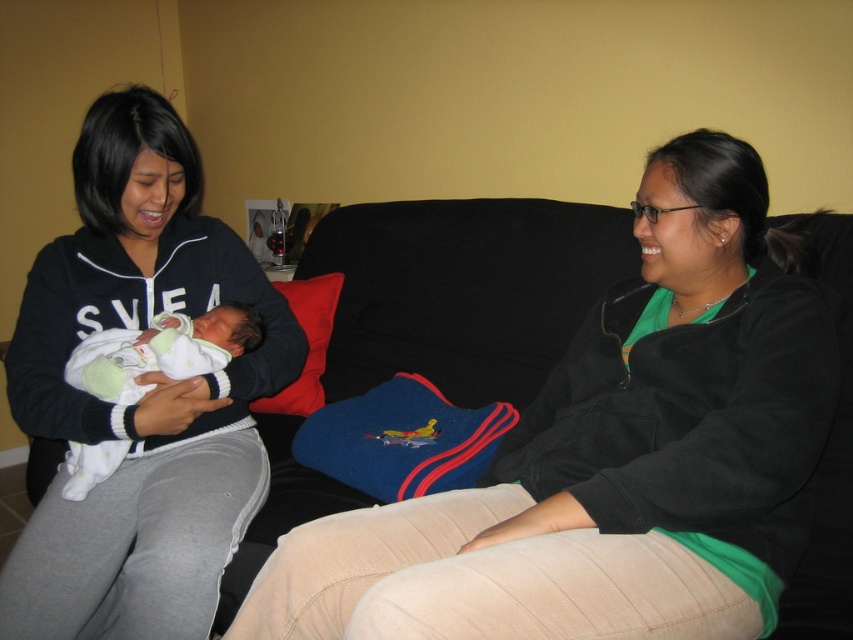
You are a tailor who needs to determine which garment requires more fabric for alterations. Based on the scene, which item has a greater width between the matte black jacket at center and the white knit sweater at left?

The matte black jacket at center has a greater width than the white knit sweater at left according to the description.

You are a tailor who needs to measure the distance between the matte black jacket at center and the white knit sweater at left for a custom fitting. Can you confirm if the space between them is sufficient to place a 24 inch ruler horizontally between them?

The matte black jacket at center and white knit sweater at left are 22.73 inches apart from each other, so the 24 inch ruler cannot fit horizontally between them as the distance is shorter than the ruler.